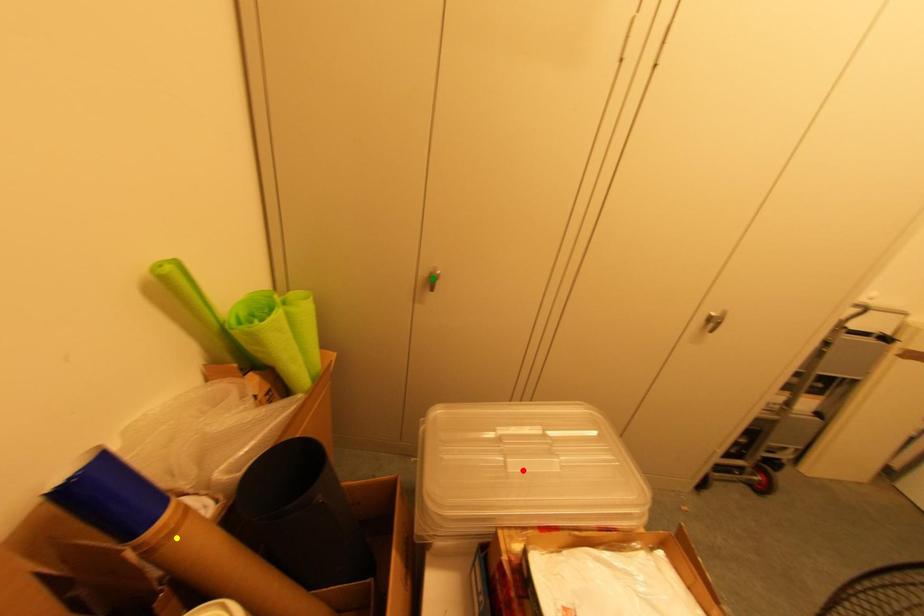
Order these from nearest to farthest:
yellow point
red point
green point

yellow point, red point, green point